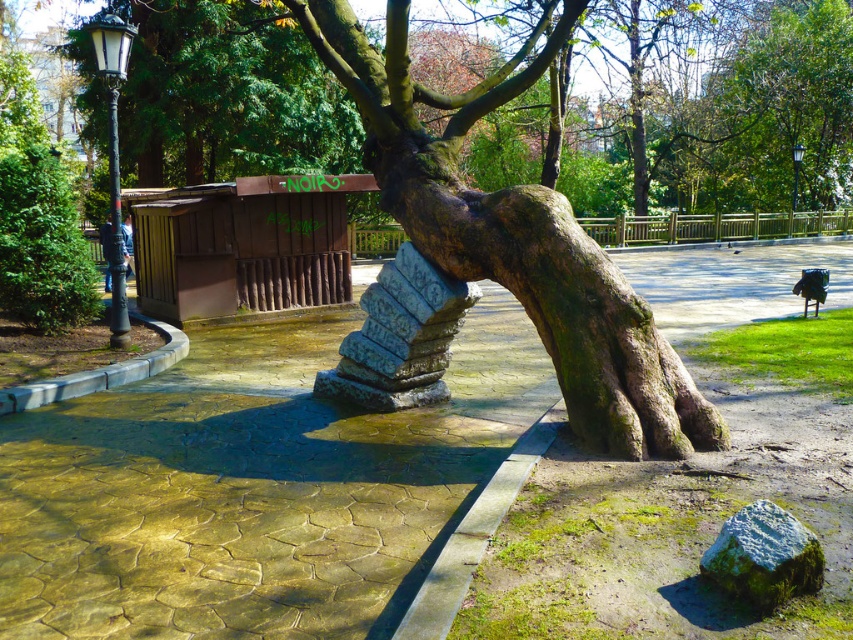
Measure the distance between point (376,292) and camera.

6.05 meters

Does stone textured column at center appear under green mossy rock at lower right?

Actually, stone textured column at center is above green mossy rock at lower right.

Who is more distant from viewer, (386, 330) or (759, 541)?

The point (386, 330) is more distant.

At what (x,y) coordinates should I click in order to perform the action: click on stone textured column at center. Please return your answer as a coordinate pair (x, y). The width and height of the screenshot is (853, 640). Looking at the image, I should click on (399, 337).

What are the coordinates of `green mossy bark tree trunk at center` in the screenshot? It's located at (552, 298).

Does green mossy bark tree trunk at center appear on the right side of stone textured column at center?

Correct, you'll find green mossy bark tree trunk at center to the right of stone textured column at center.

You are a GUI agent. You are given a task and a screenshot of the screen. Output one action in this format:
    pyautogui.click(x=<x>, y=<y>)
    Task: Click on the green mossy bark tree trunk at center
    This screenshot has width=853, height=640.
    Given the screenshot: What is the action you would take?
    pyautogui.click(x=552, y=298)

Locate an element on the screen. The image size is (853, 640). green mossy bark tree trunk at center is located at coordinates (552, 298).